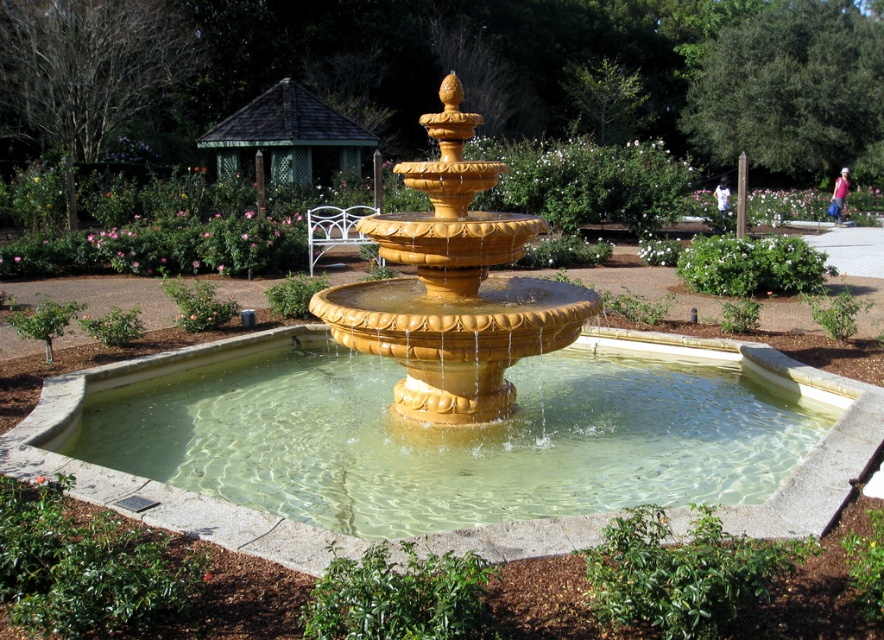
Question: Which of the following is the farthest from the observer?

Choices:
 (A) golden polished stone fountain at center
 (B) clear stone pool at center
 (C) green wooden gazebo at upper center

Answer: (C)

Question: Where is clear stone pool at center located in relation to golden polished stone fountain at center in the image?

Choices:
 (A) right
 (B) left

Answer: (A)

Question: Which object is the farthest from the clear stone pool at center?

Choices:
 (A) golden polished stone fountain at center
 (B) green wooden gazebo at upper center

Answer: (B)

Question: Is clear stone pool at center to the right of golden polished stone fountain at center from the viewer's perspective?

Choices:
 (A) yes
 (B) no

Answer: (A)

Question: Is golden polished stone fountain at center further to camera compared to green wooden gazebo at upper center?

Choices:
 (A) no
 (B) yes

Answer: (A)

Question: Which point is closer to the camera?

Choices:
 (A) green wooden gazebo at upper center
 (B) clear stone pool at center

Answer: (B)